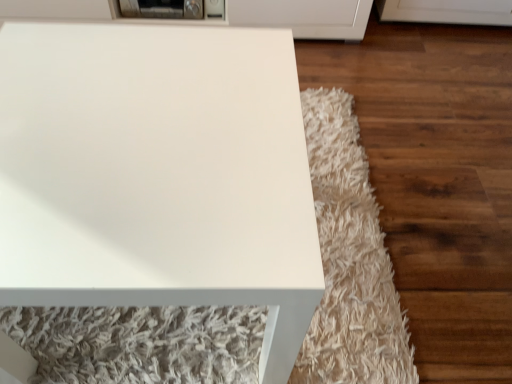
Question: Does metallic gray toaster at upper center contain white glossy table at center?

Choices:
 (A) no
 (B) yes

Answer: (A)

Question: Is metallic gray toaster at upper center facing away from white glossy table at center?

Choices:
 (A) yes
 (B) no

Answer: (B)

Question: From the image's perspective, is metallic gray toaster at upper center on top of white glossy table at center?

Choices:
 (A) yes
 (B) no

Answer: (A)

Question: Considering the relative sizes of metallic gray toaster at upper center and white glossy table at center in the image provided, is metallic gray toaster at upper center taller than white glossy table at center?

Choices:
 (A) yes
 (B) no

Answer: (B)

Question: Is metallic gray toaster at upper center aimed at white glossy table at center?

Choices:
 (A) no
 (B) yes

Answer: (B)

Question: Is metallic gray toaster at upper center closer to the viewer compared to white glossy table at center?

Choices:
 (A) no
 (B) yes

Answer: (A)

Question: Is white glossy table at center closer to camera compared to metallic gray toaster at upper center?

Choices:
 (A) yes
 (B) no

Answer: (A)

Question: From the image's perspective, would you say white glossy table at center is positioned over metallic gray toaster at upper center?

Choices:
 (A) yes
 (B) no

Answer: (B)

Question: Considering the relative positions of white glossy table at center and metallic gray toaster at upper center in the image provided, is white glossy table at center behind metallic gray toaster at upper center?

Choices:
 (A) yes
 (B) no

Answer: (B)

Question: From a real-world perspective, is white glossy table at center on metallic gray toaster at upper center?

Choices:
 (A) no
 (B) yes

Answer: (B)

Question: From a real-world perspective, is white glossy table at center located beneath metallic gray toaster at upper center?

Choices:
 (A) yes
 (B) no

Answer: (B)

Question: From the image's perspective, is white glossy table at center beneath metallic gray toaster at upper center?

Choices:
 (A) no
 (B) yes

Answer: (B)

Question: Considering the positions of metallic gray toaster at upper center and white glossy table at center in the image, is metallic gray toaster at upper center bigger or smaller than white glossy table at center?

Choices:
 (A) big
 (B) small

Answer: (B)